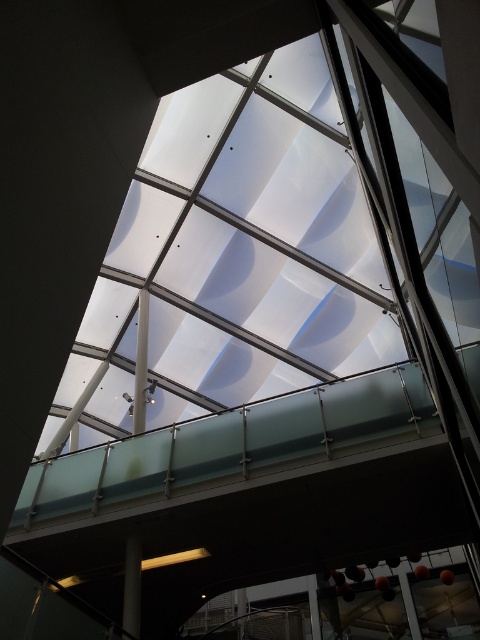
Question: Is white glossy pillar at center positioned before smooth gray pillar at lower left?

Choices:
 (A) no
 (B) yes

Answer: (A)

Question: Is white glossy pillar at center further to camera compared to smooth gray pillar at lower left?

Choices:
 (A) no
 (B) yes

Answer: (B)

Question: Is white glossy pillar at center closer to the viewer compared to smooth gray pillar at lower left?

Choices:
 (A) no
 (B) yes

Answer: (A)

Question: Which point is farther from the camera taking this photo?

Choices:
 (A) (137, 419)
 (B) (132, 618)

Answer: (A)